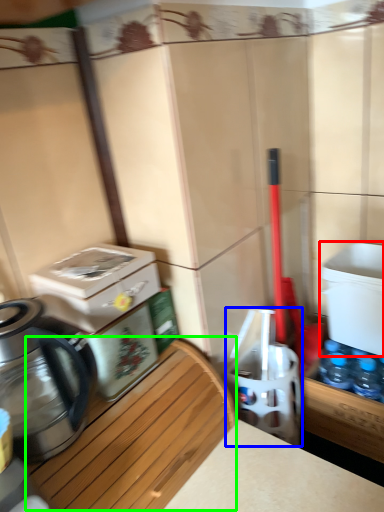
Question: Estimate the real-world distances between objects in this image. Which object is farther from water cooler (highlighted by a red box), water cooler (highlighted by a blue box) or wood (highlighted by a green box)?

Choices:
 (A) water cooler
 (B) wood

Answer: (B)